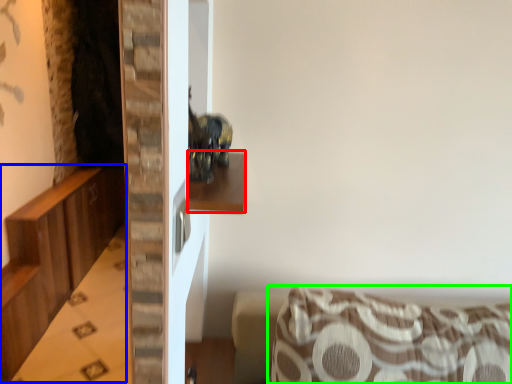
Question: Which is farther away from shelf (highlighted by a red box)? dresser (highlighted by a blue box) or furniture (highlighted by a green box)?

Choices:
 (A) dresser
 (B) furniture

Answer: (A)